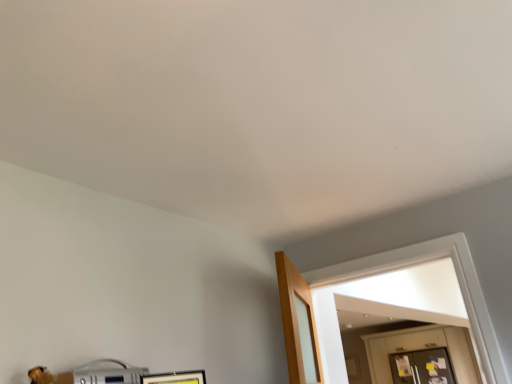
Image resolution: width=512 pixels, height=384 pixels. I want to click on wooden door at lower right, so point(423,348).

The height and width of the screenshot is (384, 512). What do you see at coordinates (423, 348) in the screenshot?
I see `wooden door at lower right` at bounding box center [423, 348].

What is the approximate height of wooden door at lower right?

It is 1.02 meters.

In the scene shown: Measure the distance between point [466,357] and camera.

They are 5.30 meters apart.

This screenshot has width=512, height=384. What do you see at coordinates (422, 367) in the screenshot?
I see `clear glass door at right` at bounding box center [422, 367].

At what (x,y) coordinates should I click in order to perform the action: click on clear glass door at right. Please return your answer as a coordinate pair (x, y). Looking at the image, I should click on (422, 367).

Where is `wooden door at lower right`? This screenshot has height=384, width=512. wooden door at lower right is located at coordinates (423, 348).

Which is more to the right, wooden door at lower right or clear glass door at right?

wooden door at lower right.

Is wooden door at lower right positioned in front of clear glass door at right?

Yes, wooden door at lower right is closer to the camera.

Does point (369, 363) appear closer or farther from the camera than point (443, 365)?

Clearly, point (369, 363) is more distant from the camera than point (443, 365).

From the image's perspective, is wooden door at lower right beneath clear glass door at right?

No, from the image's perspective, wooden door at lower right is not below clear glass door at right.

From a real-world perspective, is wooden door at lower right located higher than clear glass door at right?

Indeed, from a real-world perspective, wooden door at lower right stands above clear glass door at right.

Does wooden door at lower right have a greater width compared to clear glass door at right?

Yes.

Considering the sizes of objects wooden door at lower right and clear glass door at right in the image provided, who is shorter, wooden door at lower right or clear glass door at right?

With less height is clear glass door at right.

Considering the relative sizes of wooden door at lower right and clear glass door at right in the image provided, is wooden door at lower right smaller than clear glass door at right?

No.

Would you say wooden door at lower right contains clear glass door at right?

No, clear glass door at right is not a part of wooden door at lower right.

Is wooden door at lower right not near clear glass door at right?

No, there isn't a large distance between wooden door at lower right and clear glass door at right.

In the scene shown: Is wooden door at lower right looking in the opposite direction of clear glass door at right?

Absolutely, wooden door at lower right is directed away from clear glass door at right.

What's the angular difference between wooden door at lower right and clear glass door at right's facing directions?

The facing directions of wooden door at lower right and clear glass door at right are 1.61 degrees apart.

Measure the distance between wooden door at lower right and clear glass door at right.

7.15 inches.

The image size is (512, 384). In order to click on glass door below the wooden door at lower right (from the image's perspective) in this screenshot , I will do coord(422,367).

Visually, is clear glass door at right positioned to the left or to the right of wooden door at lower right?

From the image, it's evident that clear glass door at right is to the left of wooden door at lower right.

Is the depth of clear glass door at right greater than that of wooden door at lower right?

Yes, the depth of clear glass door at right is greater than that of wooden door at lower right.

Which is nearer, (392, 359) or (470, 361)?

Point (392, 359).

From the image's perspective, is clear glass door at right above or below wooden door at lower right?

Based on their image positions, clear glass door at right is located beneath wooden door at lower right.

From a real-world perspective, is clear glass door at right on top of wooden door at lower right?

No, from a real-world perspective, clear glass door at right is not above wooden door at lower right.

Which object is thinner, clear glass door at right or wooden door at lower right?

With smaller width is clear glass door at right.

Is clear glass door at right taller or shorter than wooden door at lower right?

clear glass door at right is shorter than wooden door at lower right.

Can you confirm if clear glass door at right is bigger than wooden door at lower right?

Incorrect, clear glass door at right is not larger than wooden door at lower right.

Would you say clear glass door at right is inside or outside wooden door at lower right?

clear glass door at right is located beyond the bounds of wooden door at lower right.

Is clear glass door at right directly adjacent to wooden door at lower right?

There is a gap between clear glass door at right and wooden door at lower right.

Is clear glass door at right positioned with its back to wooden door at lower right?

Yes, clear glass door at right is facing away from wooden door at lower right.

How many degrees apart are the facing directions of clear glass door at right and wooden door at lower right?

The facing directions of clear glass door at right and wooden door at lower right are 1.61 degrees apart.

You are a GUI agent. You are given a task and a screenshot of the screen. Output one action in this format:
    pyautogui.click(x=<x>, y=<y>)
    Task: Click on the door on the right of clear glass door at right
    The width and height of the screenshot is (512, 384).
    Given the screenshot: What is the action you would take?
    pyautogui.click(x=423, y=348)

You are a GUI agent. You are given a task and a screenshot of the screen. Output one action in this format:
    pyautogui.click(x=<x>, y=<y>)
    Task: Click on the glass door located underneath the wooden door at lower right (from a real-world perspective)
    The height and width of the screenshot is (384, 512).
    Given the screenshot: What is the action you would take?
    pyautogui.click(x=422, y=367)

Where is `door to the right of clear glass door at right`? The image size is (512, 384). door to the right of clear glass door at right is located at coordinates (423, 348).